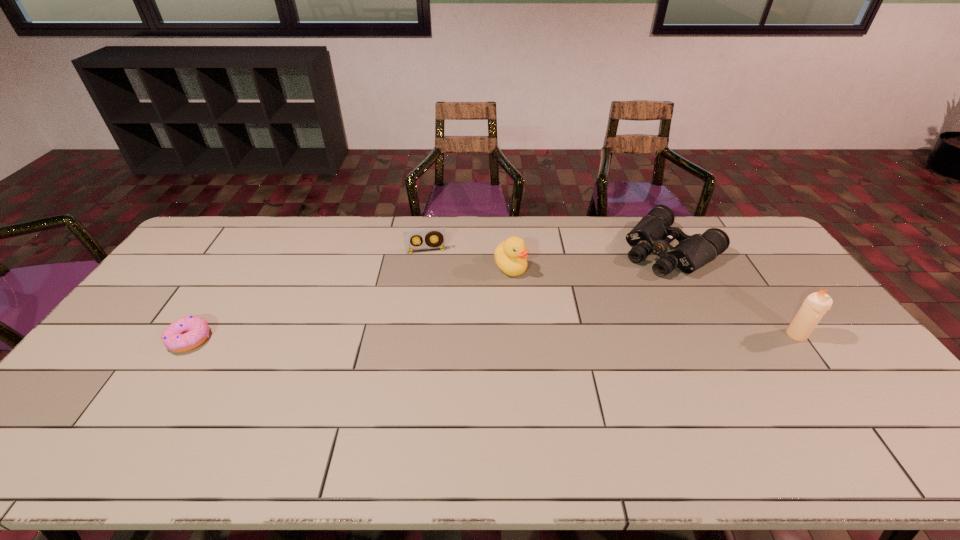
Locate an element on the screen. This screenshot has height=540, width=960. vacant space located 0.350m through the eyepieces of the fourth object from left to right is located at coordinates (580, 322).

At what (x,y) coordinates should I click in order to perform the action: click on blank space located 0.090m through the eyepieces of the fourth object from left to right. Please return your answer as a coordinate pair (x, y). This screenshot has height=540, width=960. Looking at the image, I should click on (629, 282).

Where is `free location located 0.350m through the eyepieces of the fourth object from left to right`? free location located 0.350m through the eyepieces of the fourth object from left to right is located at coordinates (580, 322).

The width and height of the screenshot is (960, 540). Identify the location of free region located 0.090m at the front of the fourth object from right to left with visible reels. (431, 271).

This screenshot has width=960, height=540. What are the coordinates of `free space located at the front of the fourth object from right to left with visible reels` in the screenshot? It's located at (430, 267).

Image resolution: width=960 pixels, height=540 pixels. Identify the location of free region located 0.110m at the front of the fourth object from right to left with visible reels. (431, 274).

Image resolution: width=960 pixels, height=540 pixels. Find the location of `vacant space located at the beak of the duck`. vacant space located at the beak of the duck is located at coordinates (588, 366).

Where is `free space located at the beak of the duck`? free space located at the beak of the duck is located at coordinates (537, 302).

The image size is (960, 540). Identify the location of vacant space situated at the beak of the duck. (577, 353).

You are a GUI agent. You are given a task and a screenshot of the screen. Output one action in this format:
    pyautogui.click(x=<x>, y=<y>)
    Task: Click on the binoculars located at the far edge
    This screenshot has height=540, width=960.
    Given the screenshot: What is the action you would take?
    pyautogui.click(x=652, y=234)